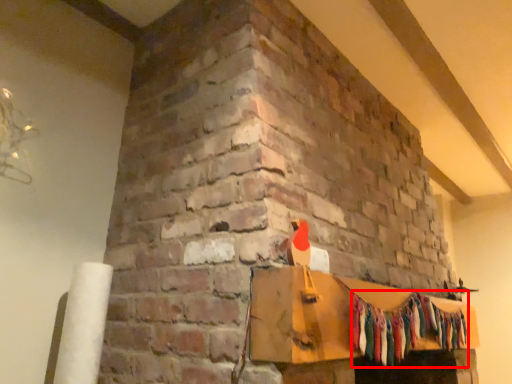
Question: Observing the image, what is the correct spatial positioning of clothing (annotated by the red box) in reference to furniture?

Choices:
 (A) right
 (B) left

Answer: (A)